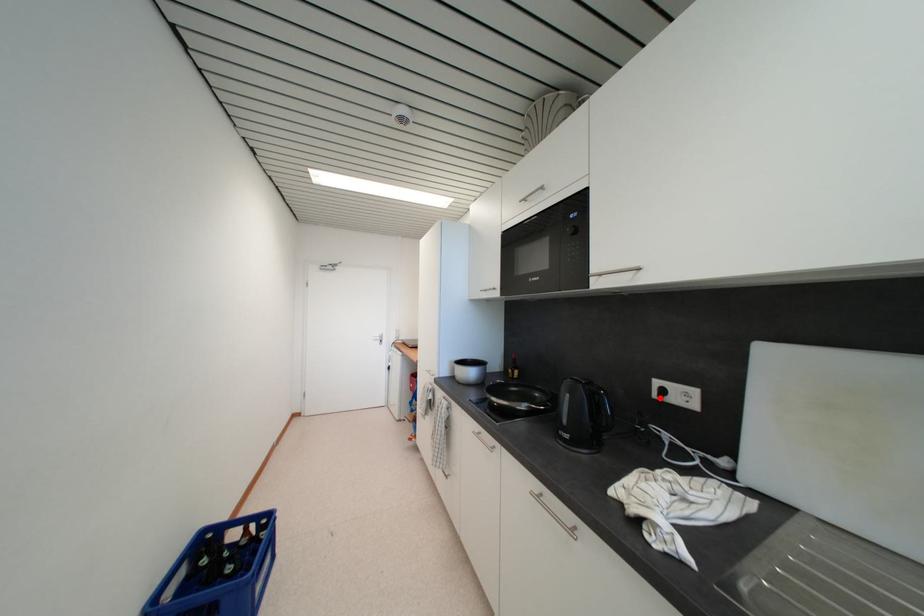
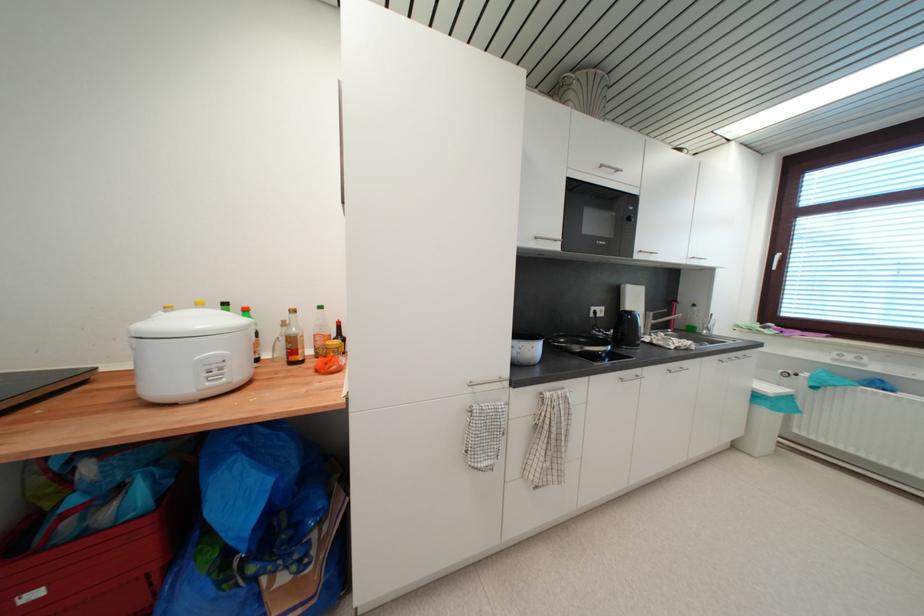
Locate, in the second image, the point that corresponds to the highlighted location in the first image.

(597, 317)